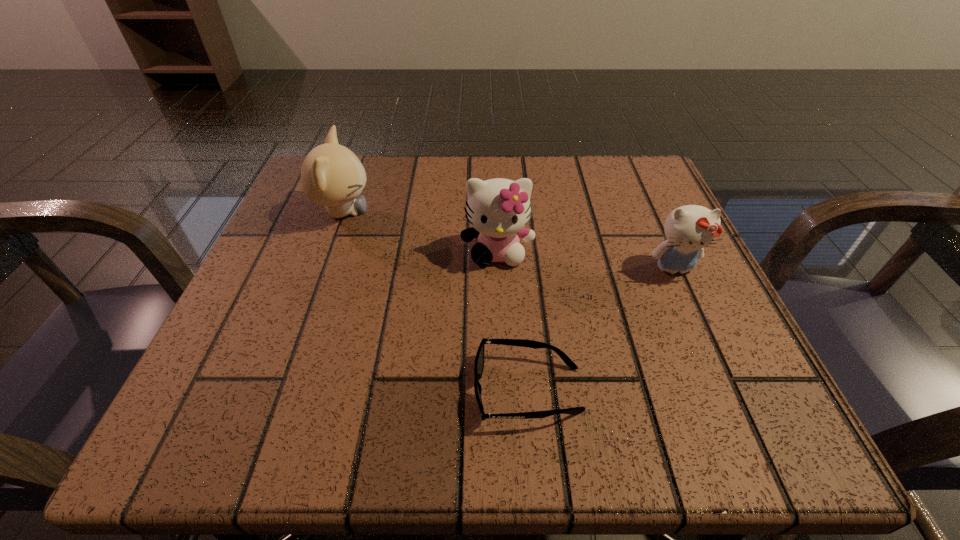
Image resolution: width=960 pixels, height=540 pixels. In order to click on vacant space that is in between the second kitten from left to right and the rightmost object in this screenshot , I will do `click(586, 260)`.

Identify the location of free area in between the farthest object and the nearest object. The height and width of the screenshot is (540, 960). (435, 301).

Locate an element on the screen. The image size is (960, 540). object that is the second nearest to the second kitten from right to left is located at coordinates (332, 175).

The image size is (960, 540). Find the location of `object that ranks as the third closest to the second kitten from left to right`. object that ranks as the third closest to the second kitten from left to right is located at coordinates (688, 229).

At what (x,y) coordinates should I click in order to perform the action: click on kitten that is the third closest one to the nearest object. Please return your answer as a coordinate pair (x, y). Image resolution: width=960 pixels, height=540 pixels. Looking at the image, I should click on (332, 175).

Find the location of `kitten that stands as the closest to the rightmost kitten`. kitten that stands as the closest to the rightmost kitten is located at coordinates (498, 209).

Identify the location of vacant space that satisfies the following two spatial constraints: 1. on the front-facing side of the shortest kitten; 2. on the front-facing side of the shortest object. Image resolution: width=960 pixels, height=540 pixels. coord(728,389).